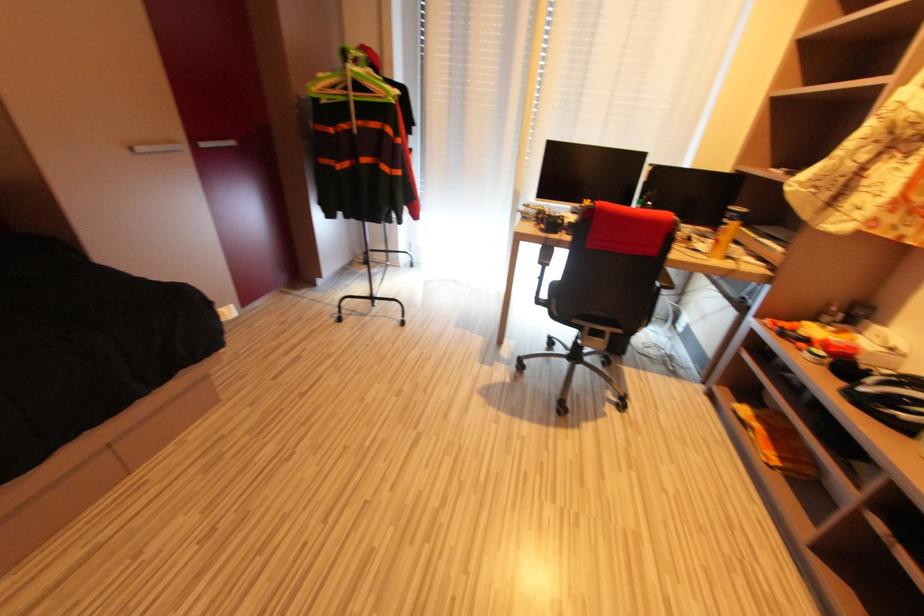
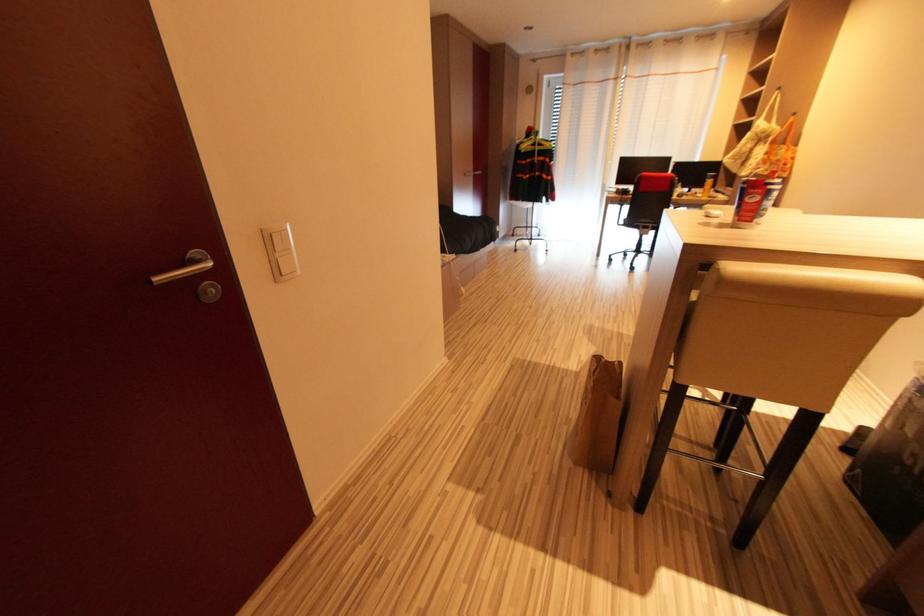
Question: In a continuous first-person perspective shot, in which direction is the camera moving?

Choices:
 (A) Left
 (B) Right
 (C) Forward
 (D) Backward

Answer: (D)